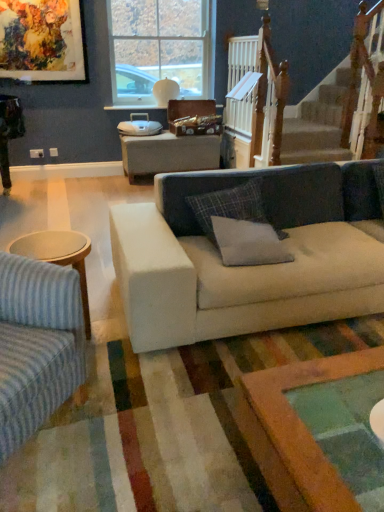
Question: Does clear glass window at upper center have a greater height compared to gray fabric pillow at center, which appears as the first pillow when ordered from the bottom?

Choices:
 (A) no
 (B) yes

Answer: (B)

Question: Can you confirm if clear glass window at upper center is positioned to the right of gray fabric pillow at center, which ranks as the 2th pillow in top-to-bottom order?

Choices:
 (A) yes
 (B) no

Answer: (B)

Question: Is clear glass window at upper center positioned with its back to gray fabric pillow at center, which appears as the first pillow when ordered from the bottom?

Choices:
 (A) no
 (B) yes

Answer: (A)

Question: Is clear glass window at upper center positioned behind gray fabric pillow at center, which ranks as the 2th pillow in top-to-bottom order?

Choices:
 (A) no
 (B) yes

Answer: (B)

Question: Is clear glass window at upper center aimed at gray fabric pillow at center, which ranks as the 2th pillow in top-to-bottom order?

Choices:
 (A) yes
 (B) no

Answer: (A)

Question: Visually, is gray fabric pillow at center, which appears as the first pillow when ordered from the bottom, positioned to the left or to the right of plaid fabric pillow at center, which is the 1th pillow from top to bottom?

Choices:
 (A) left
 (B) right

Answer: (B)

Question: Is gray fabric pillow at center, which appears as the first pillow when ordered from the bottom, inside or outside of plaid fabric pillow at center, which is the 1th pillow from top to bottom?

Choices:
 (A) outside
 (B) inside

Answer: (A)

Question: From the image's perspective, is gray fabric pillow at center, which appears as the first pillow when ordered from the bottom, positioned above or below plaid fabric pillow at center, which is counted as the 2th pillow, starting from the bottom?

Choices:
 (A) above
 (B) below

Answer: (B)

Question: Is gray fabric pillow at center, which appears as the first pillow when ordered from the bottom, in front of or behind plaid fabric pillow at center, which is counted as the 2th pillow, starting from the bottom, in the image?

Choices:
 (A) front
 (B) behind

Answer: (A)

Question: In terms of height, does plaid fabric pillow at center, which is the 1th pillow from top to bottom, look taller or shorter compared to gray fabric pillow at center, which ranks as the 2th pillow in top-to-bottom order?

Choices:
 (A) short
 (B) tall

Answer: (B)

Question: Is point (205, 201) positioned closer to the camera than point (231, 248)?

Choices:
 (A) farther
 (B) closer

Answer: (A)

Question: From a real-world perspective, is plaid fabric pillow at center, which is the 1th pillow from top to bottom, positioned above or below gray fabric pillow at center, which ranks as the 2th pillow in top-to-bottom order?

Choices:
 (A) below
 (B) above

Answer: (B)

Question: Looking at the image, does plaid fabric pillow at center, which is counted as the 2th pillow, starting from the bottom, seem bigger or smaller compared to gray fabric pillow at center, which appears as the first pillow when ordered from the bottom?

Choices:
 (A) big
 (B) small

Answer: (A)

Question: From the image's perspective, relative to white wooden railing at upper right, is plaid fabric pillow at center, which is the 1th pillow from top to bottom, above or below?

Choices:
 (A) above
 (B) below

Answer: (B)

Question: Considering the positions of plaid fabric pillow at center, which is counted as the 2th pillow, starting from the bottom, and white wooden railing at upper right in the image, is plaid fabric pillow at center, which is counted as the 2th pillow, starting from the bottom, bigger or smaller than white wooden railing at upper right?

Choices:
 (A) big
 (B) small

Answer: (B)